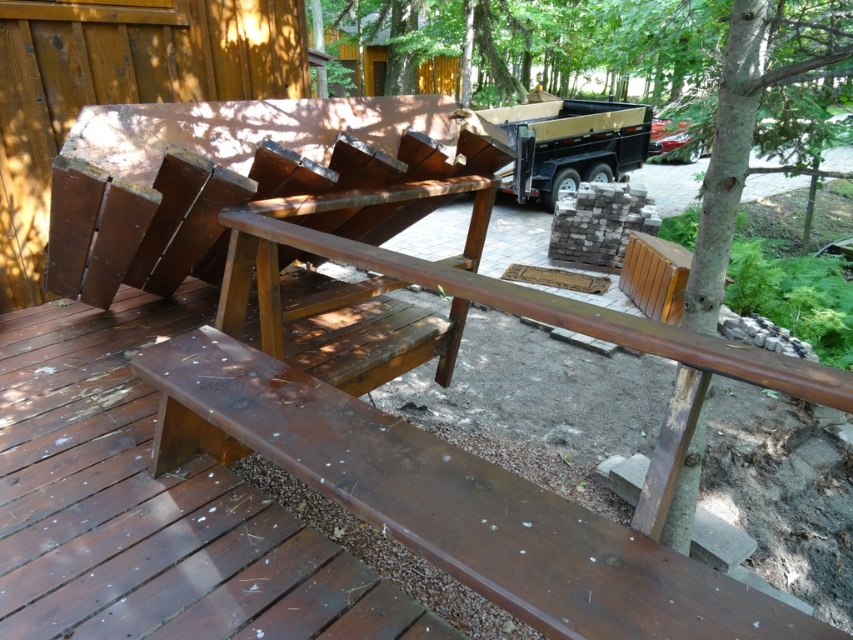
The width and height of the screenshot is (853, 640). What do you see at coordinates (463, 506) in the screenshot?
I see `matte brown bench at lower center` at bounding box center [463, 506].

Who is more forward, [314,406] or [722,195]?

Point [314,406]

The height and width of the screenshot is (640, 853). What are the coordinates of `matte brown bench at lower center` in the screenshot? It's located at (463, 506).